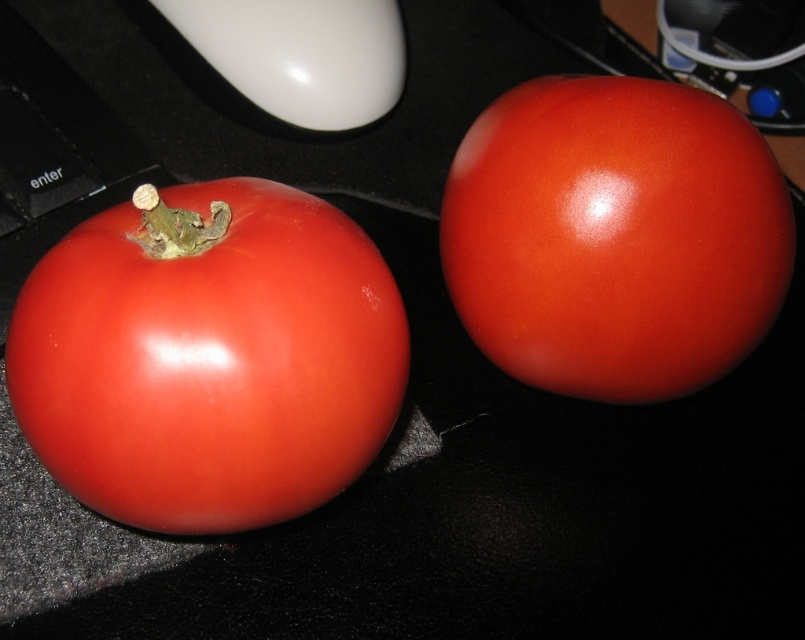
Which is in front, point (683, 352) or point (312, 10)?

Point (683, 352) is more forward.

Is point (622, 378) in front of point (287, 102)?

That is True.

This screenshot has width=805, height=640. What are the coordinates of `glossy red tomato at center` in the screenshot? It's located at (614, 236).

Does glossy red tomato at left appear over white glossy mouse at upper center?

Incorrect, glossy red tomato at left is not positioned above white glossy mouse at upper center.

Who is positioned more to the right, glossy red tomato at left or white glossy mouse at upper center?

From the viewer's perspective, white glossy mouse at upper center appears more on the right side.

Between point (266, 332) and point (362, 12), which one is positioned behind?

Positioned behind is point (362, 12).

Identify the location of glossy red tomato at left. (209, 356).

Does glossy red tomato at left appear over glossy red tomato at center?

Actually, glossy red tomato at left is below glossy red tomato at center.

Is glossy red tomato at left bigger than glossy red tomato at center?

Incorrect, glossy red tomato at left is not larger than glossy red tomato at center.

Who is more distant from viewer, (287,340) or (609,76)?

Point (609,76)

Locate an element on the screen. The image size is (805, 640). glossy red tomato at left is located at coordinates (209, 356).